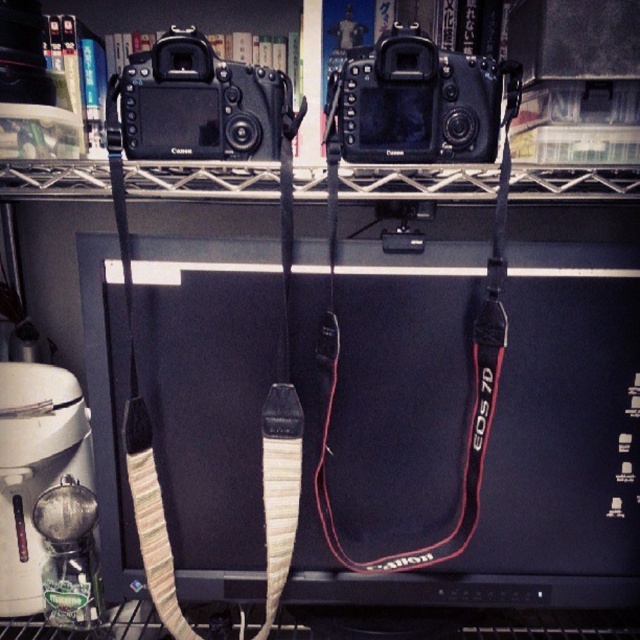
Does black matte camera at center have a smaller size compared to black matte camera at upper center?

No.

The height and width of the screenshot is (640, 640). Identify the location of black matte camera at center. (417, 102).

Where is `black matte camera at center`? black matte camera at center is located at coordinates (417, 102).